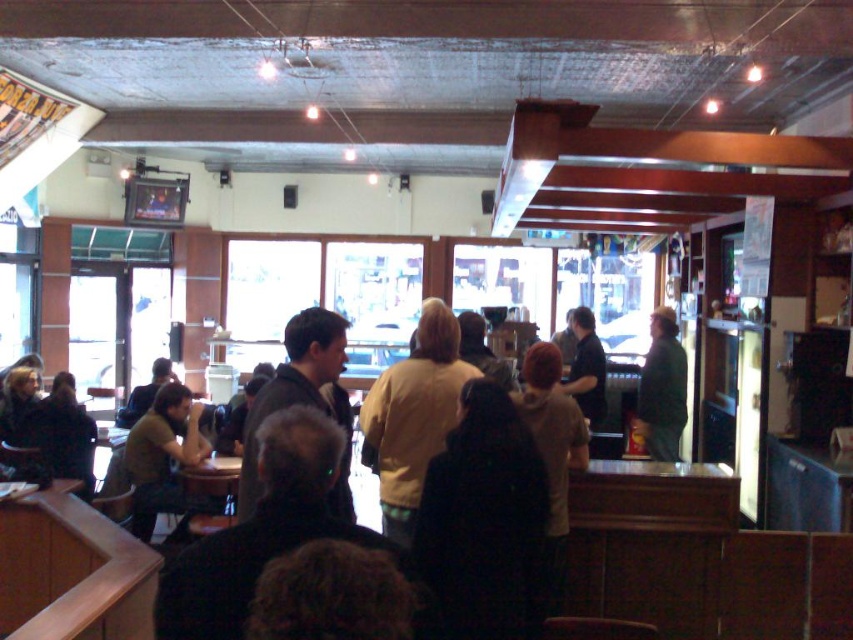
You are a customer at the dining establishment and you see two items hanging at the center of the room. The items are a light yellow jacket at center and a dark gray sweater at center. Which one is taller?

The light yellow jacket at center is taller than the dark gray sweater at center according to the description.

You are a customer entering the cafe and notice two items of clothing hanging on a rack near the entrance. The light yellow jacket at center and the matte green shirt at left. Which one is narrower?

The light yellow jacket at center is narrower than the matte green shirt at left.

You are a customer at the dining establishment and you see two items of clothing hanging on a rack near the entrance. The light yellow jacket at center and the matte green shirt at left. Which one is smaller in size?

The light yellow jacket at center is smaller in size compared to the matte green shirt at left.